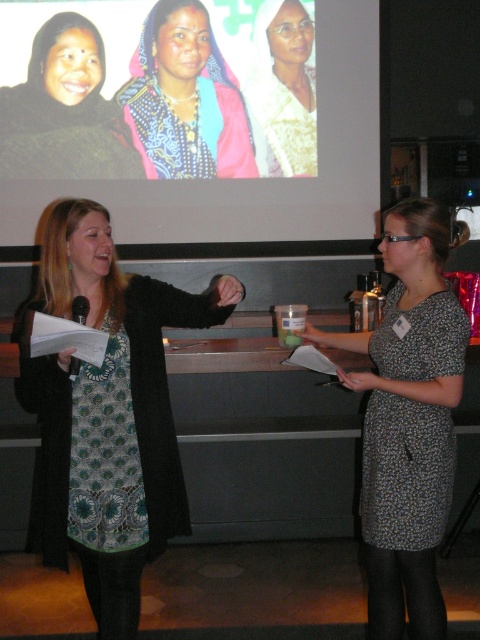
You are a photographer taking a photo of the two women in the scene. You want to ensure that both the printed fabric dress at center and the blue and white patterned scarf at center are clearly visible in the frame. Which object should you focus on first to make sure both are in focus?

The printed fabric dress at center is positioned under the blue and white patterned scarf at center. To ensure both are in focus, focus on the printed fabric dress at center first since it is closer to the camera, and the scarf will naturally be in focus as it is above it.

You are organizing a fashion show and need to decide which scarf to feature based on their sizes. Given the blue and white patterned scarf at center and the white textured scarf at upper center, which one is wider?

The blue and white patterned scarf at center is wider than the white textured scarf at upper center.

You are organizing a photoshoot and need to place a 1.2 meter wide backdrop behind the two women. Given that the patterned fabric dress at center and the matte black dress at upper left are in the frame, which dress would require more space to avoid being cut off by the backdrop edges?

The matte black dress at upper left requires more space because it has a greater width compared to the patterned fabric dress at center, so placing the backdrop behind it would need to account for its wider size to avoid being cut off.